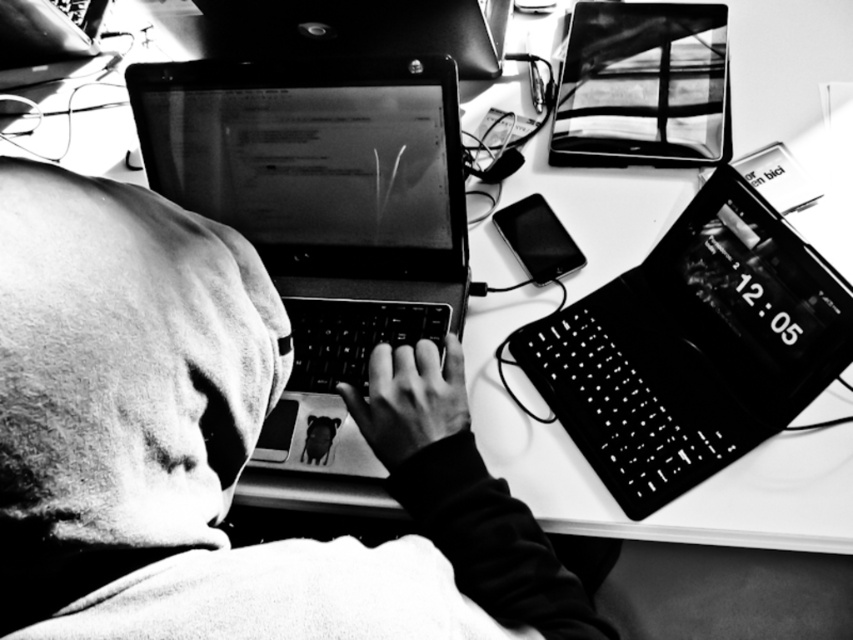
You are standing in front of the desk in the image. You need to reach two points on the desk to retrieve items. The first point is at coordinates point (280,204), and the second is at point (782,321). Which point should you reach first if you want to retrieve the items in the order they are closest to you?

You should reach point (782,321) first because it is closer to you than point (280,204), which is behind it.

Based on the scene description, can you determine the spatial relationship between the smooth fabric hoodie at center and the glossy plastic laptop at upper center?

The smooth fabric hoodie at center is below the glossy plastic laptop at upper center.